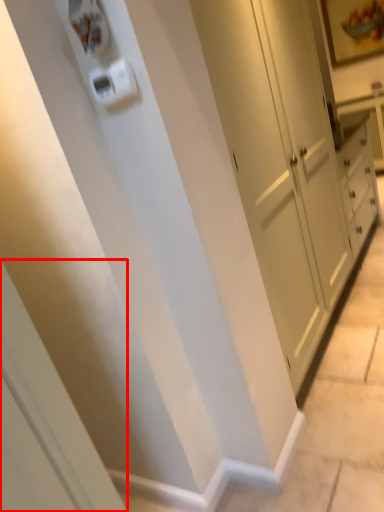
Question: From the image's perspective, what is the correct spatial relationship of screen door (annotated by the red box) in relation to light switch?

Choices:
 (A) above
 (B) below

Answer: (B)